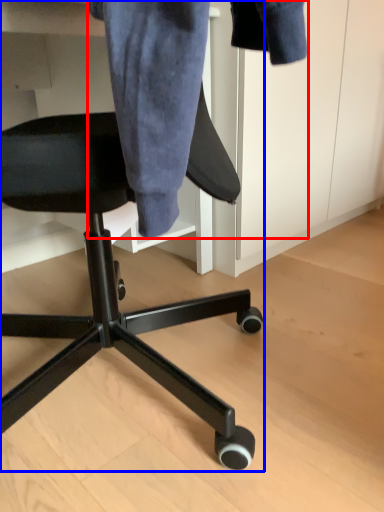
Question: Which object is closer to the camera taking this photo, denim jacket (highlighted by a red box) or chair (highlighted by a blue box)?

Choices:
 (A) denim jacket
 (B) chair

Answer: (B)